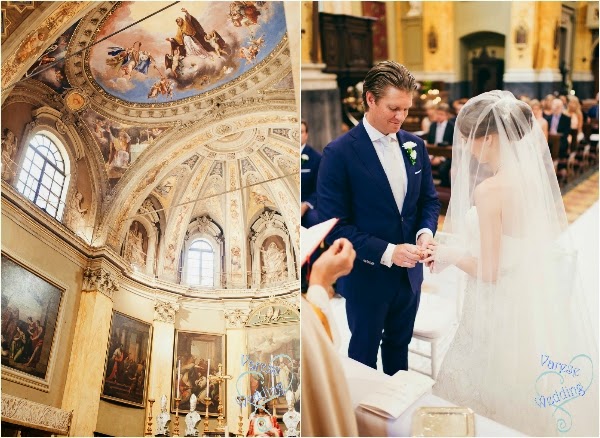
This screenshot has height=438, width=600. In order to click on arched window in this screenshot , I will do `click(39, 160)`.